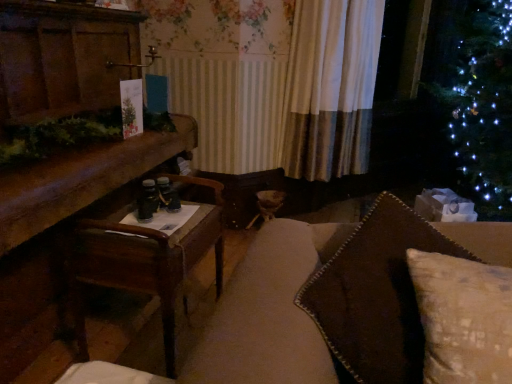
Question: Is wooden table at left wider or thinner than wooden table at left?

Choices:
 (A) wide
 (B) thin

Answer: (A)

Question: Considering the positions of wooden table at left and wooden table at left in the image, is wooden table at left taller or shorter than wooden table at left?

Choices:
 (A) short
 (B) tall

Answer: (B)

Question: Considering the real-world distances, which object is closest to the brown textured pillow at right?

Choices:
 (A) wooden table at left
 (B) wooden table at left
 (C) white textured curtain at center

Answer: (A)

Question: Which is farther from the brown textured pillow at right?

Choices:
 (A) white textured curtain at center
 (B) wooden table at left
 (C) wooden table at left

Answer: (A)